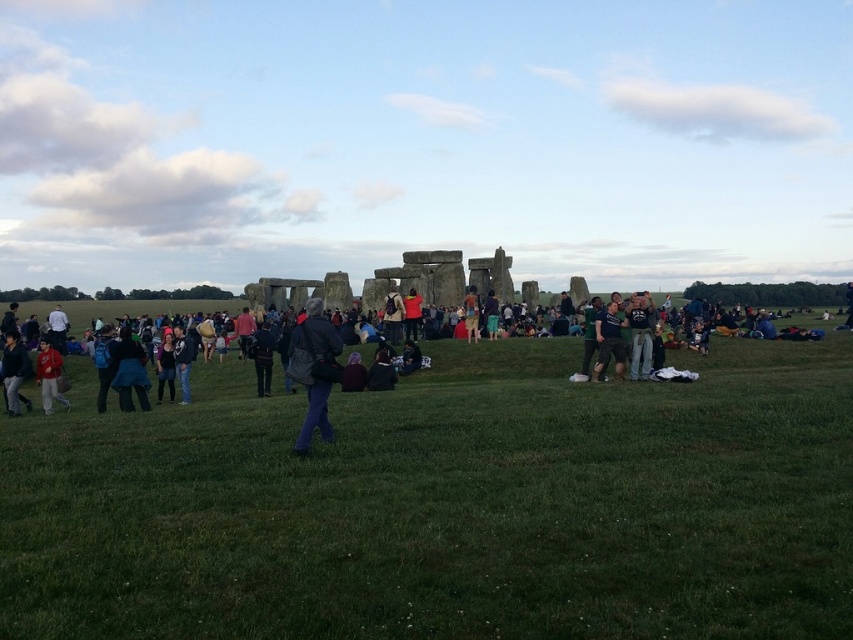
You are standing at the origin point of the coordinate system where the dark gray jacket at center is located at coordinates 0.581, 0.448. If you want to move directly towards the monument stones, which direction should you move relative to your current position?

To move directly towards the monument stones from the dark gray jacket at center located at coordinates [381,371], you would need to move in the direction indicated by the coordinate system. Since the monument is the central feature of the image, typically positioned at the center, you would likely move towards the center point of the coordinate system, which is [0,0]. However, without specific coordinate details for the stones, the exact direction can only be inferred based on standard image coordinate sy

You are a photographer at Stonehenge and want to take a photo that includes both the matte black jacket at center and the matte red jacket at center. Which jacket should you focus on first to ensure both are in frame?

The matte black jacket at center is bigger than the matte red jacket at center, so focusing on the larger matte black jacket at center first will help ensure both are in frame.

In the scene shown: You are a photographer at Stonehenge and want to take a picture of the dark blue shirt at center and the matte red jacket at center. Which one should you focus on first if you want to capture both in the frame without moving the camera?

You should focus on the matte red jacket at center first because the dark blue shirt at center is positioned to its right, so adjusting focus from left to right would naturally include both in the frame.